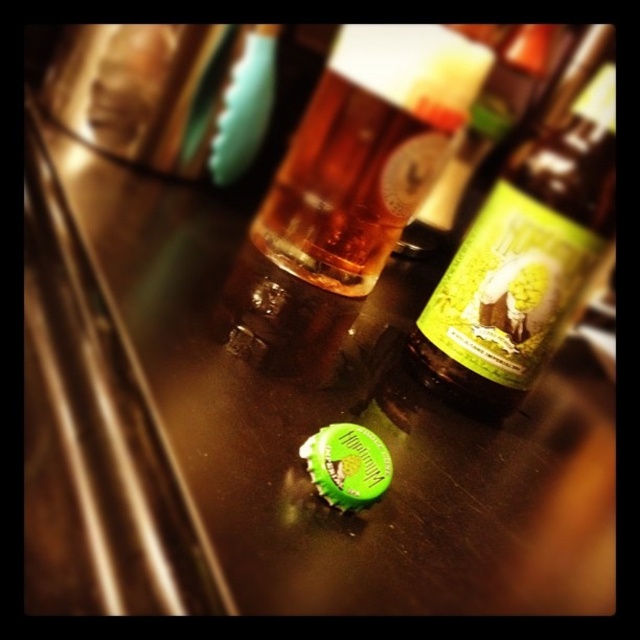
You are a bartender trying to locate the green matte bottle at center on a bar counter. Using a coordinate system where the bottom left corner is the origin, can you determine its position?

The green matte bottle at center is located at the 2D coordinates of point [529,246].

Consider the image. You are a bartender preparing to stack drinks on the bar counter. You have a green matte bottle at center and a translucent amber glass at center in front of you. Which object should you place first if you want to stack taller items on top?

The green matte bottle at center is much taller than the translucent amber glass at center, so you should place the green matte bottle at center first to ensure the taller item is at the base of the stack.

You are standing at the bar counter and want to place a small coaster between the two points, point (x=600, y=52) and point (x=396, y=136). Which point should the coaster be closer to in order to be between them?

The coaster should be closer to point (x=396, y=136) because point (x=600, y=52) is in front of point (x=396, y=136), meaning the coaster needs to be placed behind point (x=600, y=52) towards point (x=396, y=136) to be between them.